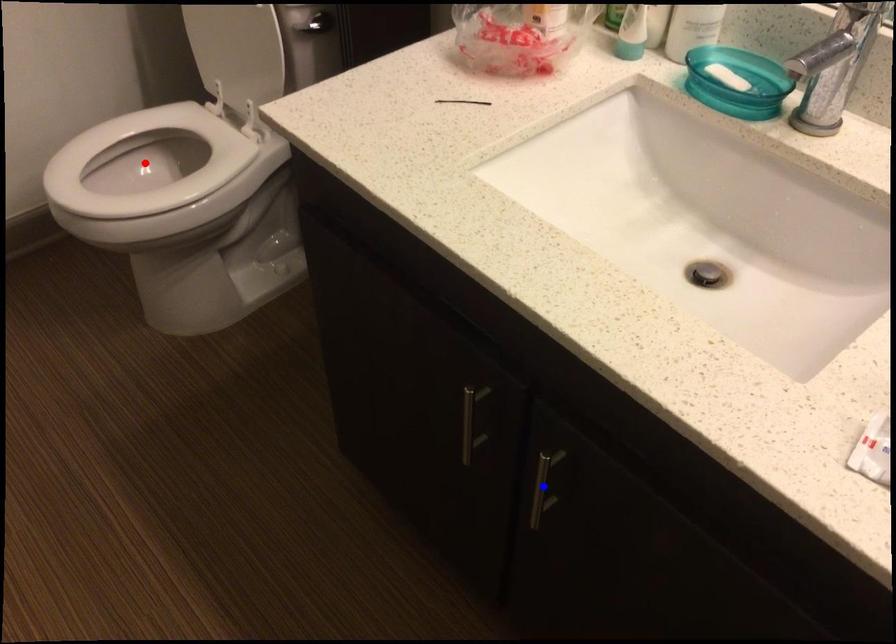
Question: Which of the two points in the image is closer to the camera?

Choices:
 (A) Blue point is closer.
 (B) Red point is closer.

Answer: (A)